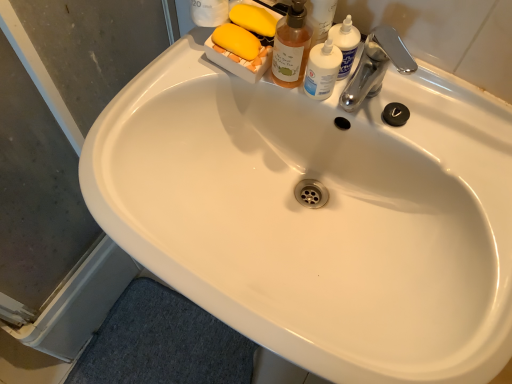
Find the location of a particular element. unoccupied region to the right of translucent plastic bottle at upper right is located at coordinates (437, 124).